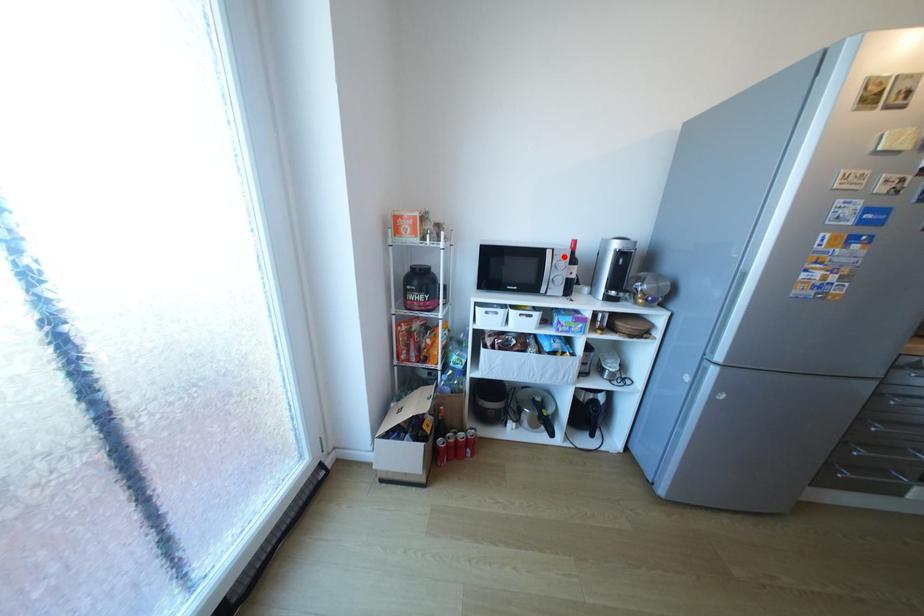
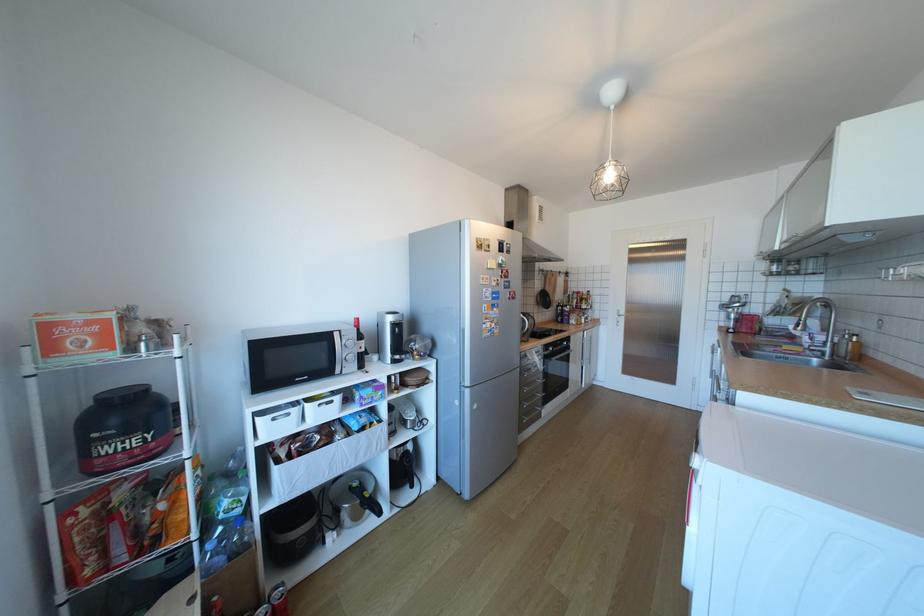
Where in the second image is the point corresponding to the highlighted location from the first image?

(351, 337)